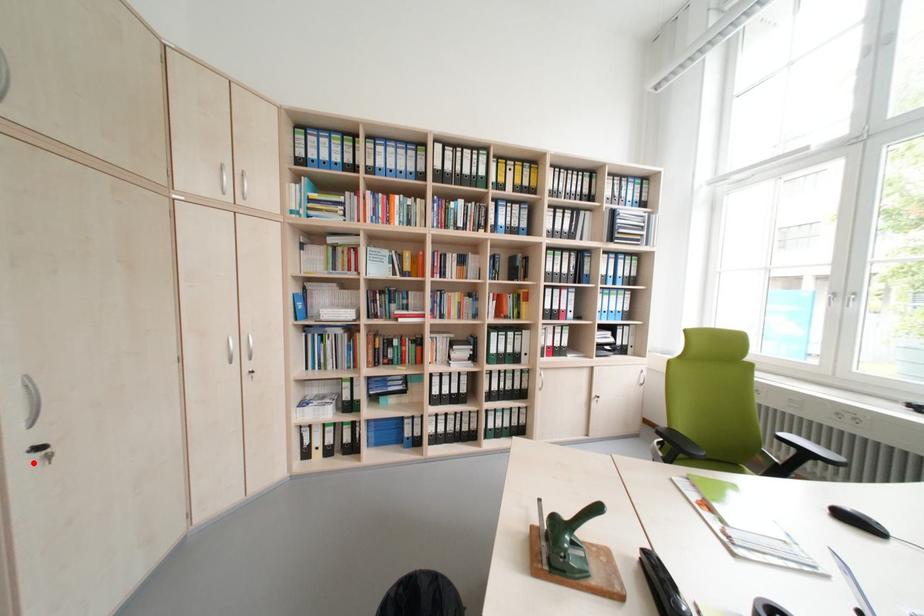
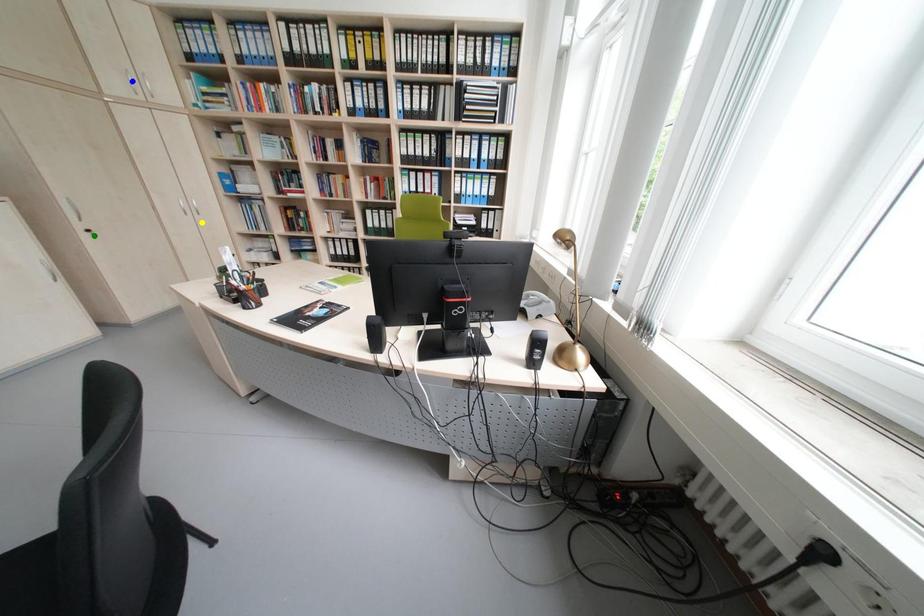
Question: I am providing you with two images of the same scene from different viewpoints. A red point is marked on the first image. You are given multiple points on the second image. Which spot in image 2 lines up with the point in image 1?

Choices:
 (A) blue point
 (B) green point
 (C) yellow point

Answer: (B)